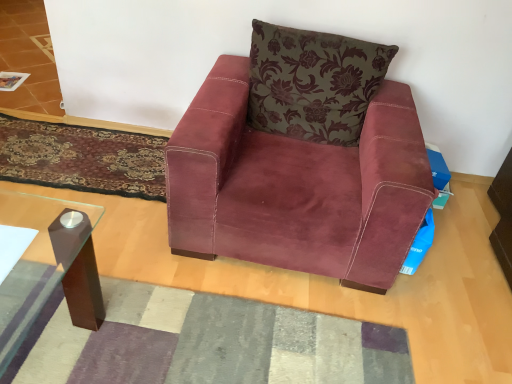
This screenshot has width=512, height=384. I want to click on vacant space in front of suede-like burgundy armchair at center, so click(251, 326).